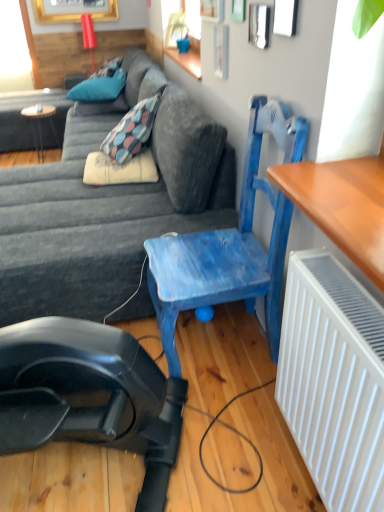
Question: From a real-world perspective, is blue fabric pillow at upper left, which ranks as the second pillow in front-to-back order, beneath dark gray fabric couch at center?

Choices:
 (A) yes
 (B) no

Answer: (B)

Question: Does blue fabric pillow at upper left, placed as the 2th pillow when sorted from back to front, have a smaller size compared to dark gray fabric couch at center?

Choices:
 (A) no
 (B) yes

Answer: (B)

Question: Considering the relative sizes of blue fabric pillow at upper left, placed as the 2th pillow when sorted from back to front, and dark gray fabric couch at center in the image provided, is blue fabric pillow at upper left, placed as the 2th pillow when sorted from back to front, shorter than dark gray fabric couch at center?

Choices:
 (A) yes
 (B) no

Answer: (A)

Question: Is blue fabric pillow at upper left, acting as the 1th pillow starting from the top, bigger than dark gray fabric couch at center?

Choices:
 (A) yes
 (B) no

Answer: (B)

Question: Is blue fabric pillow at upper left, which ranks as the second pillow in front-to-back order, turned away from dark gray fabric couch at center?

Choices:
 (A) no
 (B) yes

Answer: (A)

Question: Considering the positions of point (99, 202) and point (109, 103), is point (99, 202) closer or farther from the camera than point (109, 103)?

Choices:
 (A) closer
 (B) farther

Answer: (A)

Question: Looking at the image, does dark gray fabric couch at center seem bigger or smaller compared to teal fabric pillow at upper left, acting as the 2th pillow starting from the top?

Choices:
 (A) small
 (B) big

Answer: (B)

Question: Do you think dark gray fabric couch at center is within teal fabric pillow at upper left, which appears as the third pillow when viewed from the front, or outside of it?

Choices:
 (A) inside
 (B) outside

Answer: (B)

Question: From the image's perspective, is dark gray fabric couch at center above or below teal fabric pillow at upper left, which appears as the third pillow when viewed from the front?

Choices:
 (A) below
 (B) above

Answer: (A)

Question: Does point (183, 254) appear closer or farther from the camera than point (41, 160)?

Choices:
 (A) farther
 (B) closer

Answer: (B)

Question: Is blue painted wood chair at center inside or outside of wooden round table at left?

Choices:
 (A) outside
 (B) inside

Answer: (A)

Question: Considering the relative positions of blue painted wood chair at center and wooden round table at left in the image provided, is blue painted wood chair at center to the left or to the right of wooden round table at left?

Choices:
 (A) left
 (B) right

Answer: (B)

Question: In terms of width, does blue painted wood chair at center look wider or thinner when compared to wooden round table at left?

Choices:
 (A) wide
 (B) thin

Answer: (A)

Question: From a real-world perspective, is wooden round table at left positioned above or below blue painted wood chair at center?

Choices:
 (A) above
 (B) below

Answer: (B)

Question: Would you say wooden round table at left is inside or outside blue painted wood chair at center?

Choices:
 (A) outside
 (B) inside

Answer: (A)